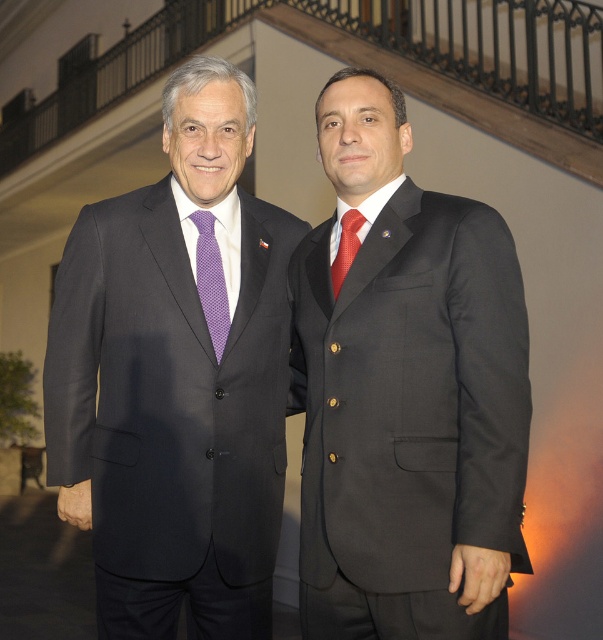
Question: Considering the relative positions of purple dotted tie at left and red silk tie at center in the image provided, where is purple dotted tie at left located with respect to red silk tie at center?

Choices:
 (A) right
 (B) left

Answer: (B)

Question: Observing the image, what is the correct spatial positioning of matte black suit at right in reference to red silk tie at center?

Choices:
 (A) above
 (B) below

Answer: (B)

Question: Which point is closer to the camera?

Choices:
 (A) red silk tie at center
 (B) matte black suit at right

Answer: (B)

Question: Which point is closer to the camera taking this photo?

Choices:
 (A) (183, 541)
 (B) (355, 237)
 (C) (221, 282)
 (D) (517, 268)

Answer: (D)

Question: Among these points, which one is nearest to the camera?

Choices:
 (A) (238, 323)
 (B) (339, 236)
 (C) (212, 221)

Answer: (B)

Question: Observing the image, what is the correct spatial positioning of matte black suit at center in reference to red silk tie at center?

Choices:
 (A) right
 (B) left

Answer: (B)